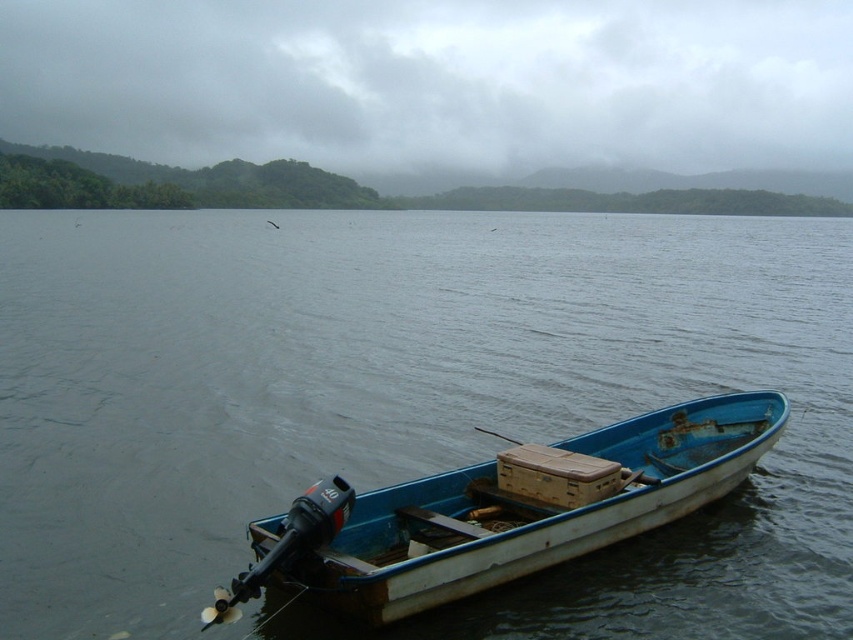
Is blue wooden boat at center to the right of blue wooden boat at lower right from the viewer's perspective?

Indeed, blue wooden boat at center is positioned on the right side of blue wooden boat at lower right.

The height and width of the screenshot is (640, 853). What do you see at coordinates (407, 403) in the screenshot?
I see `blue wooden boat at center` at bounding box center [407, 403].

Identify the location of blue wooden boat at center. (407, 403).